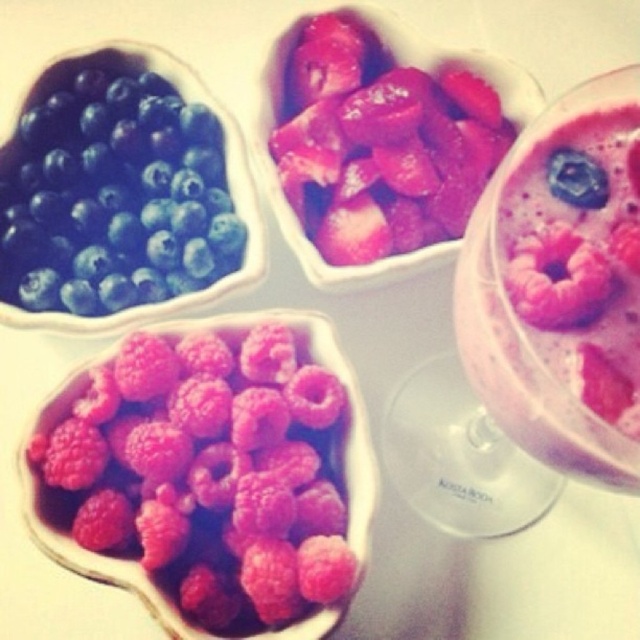
Is point (56, 476) less distant than point (541, 289)?

No, it is not.

Who is shorter, bright pink raspberry at center or pink matte raspberry at upper right?

Standing shorter between the two is pink matte raspberry at upper right.

The width and height of the screenshot is (640, 640). I want to click on bright pink raspberry at center, so click(211, 472).

Does bright pink raspberry at center lie in front of matte blueberry at upper left?

Yes, bright pink raspberry at center is in front of matte blueberry at upper left.

Is bright pink raspberry at center positioned at the back of matte blueberry at upper left?

No, it is in front of matte blueberry at upper left.

Who is more forward, (100, 372) or (100, 81)?

Point (100, 372)

Where is `bright pink raspberry at center`? This screenshot has width=640, height=640. bright pink raspberry at center is located at coordinates (211, 472).

Which is behind, point (28, 244) or point (552, 275)?

Positioned behind is point (28, 244).

Is point (84, 115) positioned in front of point (582, 252)?

No, it is behind (582, 252).

Does point (179, 269) come behind point (545, 298)?

Yes, point (179, 269) is behind point (545, 298).

The width and height of the screenshot is (640, 640). I want to click on matte blueberry at upper left, so click(115, 196).